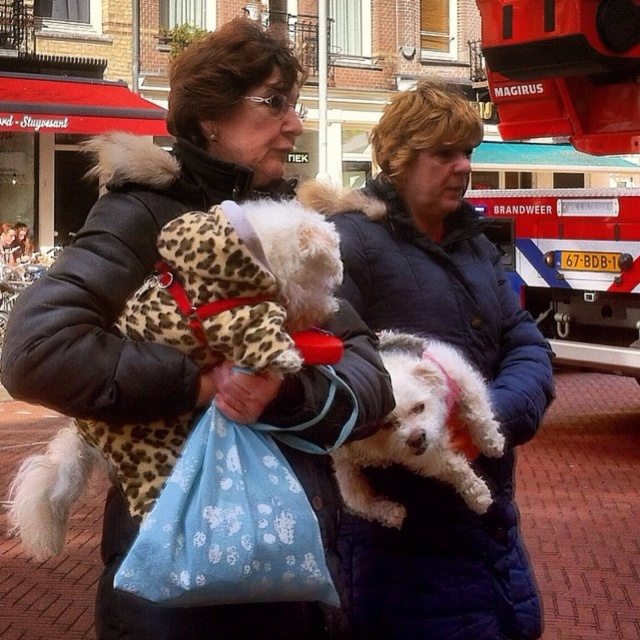
Does brushed metal fire truck at upper right lie in front of white fur dog at center?

No, it is not.

Who is more forward, [582,157] or [298,276]?

Point [298,276]

The width and height of the screenshot is (640, 640). Describe the element at coordinates (564, 72) in the screenshot. I see `brushed metal fire truck at upper right` at that location.

You are a GUI agent. You are given a task and a screenshot of the screen. Output one action in this format:
    pyautogui.click(x=<x>, y=<y>)
    Task: Click on the brushed metal fire truck at upper right
    This screenshot has height=640, width=640.
    Given the screenshot: What is the action you would take?
    pyautogui.click(x=564, y=72)

Which of these two, blue quilted jacket at center or white fluffy dog at center, stands shorter?

white fluffy dog at center is shorter.

What do you see at coordinates (464, 353) in the screenshot? I see `blue quilted jacket at center` at bounding box center [464, 353].

Is point (301, 198) positioned behind point (458, 413)?

Yes, point (301, 198) is behind point (458, 413).

At what (x,y) coordinates should I click in order to perform the action: click on blue quilted jacket at center. Please return your answer as a coordinate pair (x, y). This screenshot has width=640, height=640. Looking at the image, I should click on (464, 353).

Find the location of a particular element. The width and height of the screenshot is (640, 640). white fur dog at center is located at coordinates click(x=243, y=284).

Which of these two, white fur dog at center or blue fabric bag at center, stands shorter?

white fur dog at center

Is point (54, 512) closer to camera compared to point (221, 561)?

That is False.

The height and width of the screenshot is (640, 640). I want to click on white fur dog at center, so click(x=243, y=284).